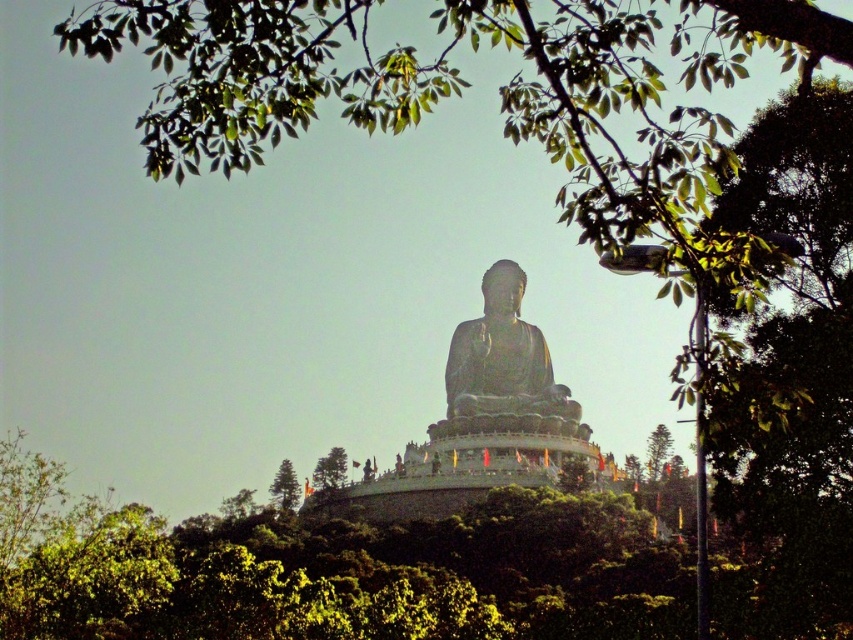
Which of these two, green leafy tree at center or green textured pine tree at center, stands taller?

With more height is green textured pine tree at center.

Which is more to the right, green leafy tree at center or green textured pine tree at center?

green leafy tree at center

Measure the distance between green leafy tree at center and camera.

149.79 meters

Where is `green leafy tree at center`? This screenshot has width=853, height=640. green leafy tree at center is located at coordinates (329, 468).

Between black polished stone buddha at center and green leafy tree at center, which one has more height?

With more height is black polished stone buddha at center.

Is point (543, 358) farther from viewer compared to point (328, 461)?

That is False.

Identify the location of black polished stone buddha at center. (503, 369).

Between point (486, 305) and point (296, 484), which one is positioned behind?

The point (486, 305) is more distant.

Based on the photo, is black polished stone buddha at center below green textured pine tree at center?

Actually, black polished stone buddha at center is above green textured pine tree at center.

Measure the distance between black polished stone buddha at center and camera.

151.32 meters

This screenshot has width=853, height=640. What are the coordinates of `black polished stone buddha at center` in the screenshot? It's located at (503, 369).